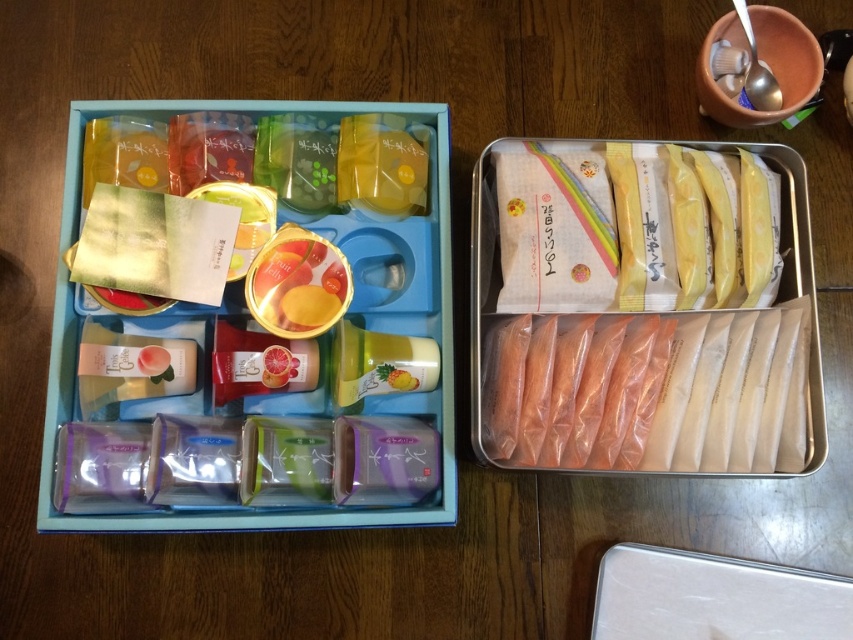
Who is positioned more to the left, translucent plastic bag at center or golden glossy jar at center?

Positioned to the left is golden glossy jar at center.

Between point (712, 344) and point (273, 240), which one is positioned in front?

Point (712, 344) is in front.

I want to click on translucent plastic bag at center, so click(650, 392).

Is translucent plastic bag at center below matte plastic lunch box at center?

Yes, translucent plastic bag at center is below matte plastic lunch box at center.

Image resolution: width=853 pixels, height=640 pixels. What do you see at coordinates (650, 392) in the screenshot?
I see `translucent plastic bag at center` at bounding box center [650, 392].

The width and height of the screenshot is (853, 640). In order to click on translucent plastic bag at center in this screenshot , I will do `click(650, 392)`.

Is matte plastic lunch box at center closer to the viewer compared to golden glossy jar at center?

Yes, it is in front of golden glossy jar at center.

Can you confirm if matte plastic lunch box at center is smaller than golden glossy jar at center?

No.

This screenshot has height=640, width=853. Describe the element at coordinates (78, 330) in the screenshot. I see `matte plastic lunch box at center` at that location.

Where is `matte plastic lunch box at center`? This screenshot has width=853, height=640. matte plastic lunch box at center is located at coordinates (78, 330).